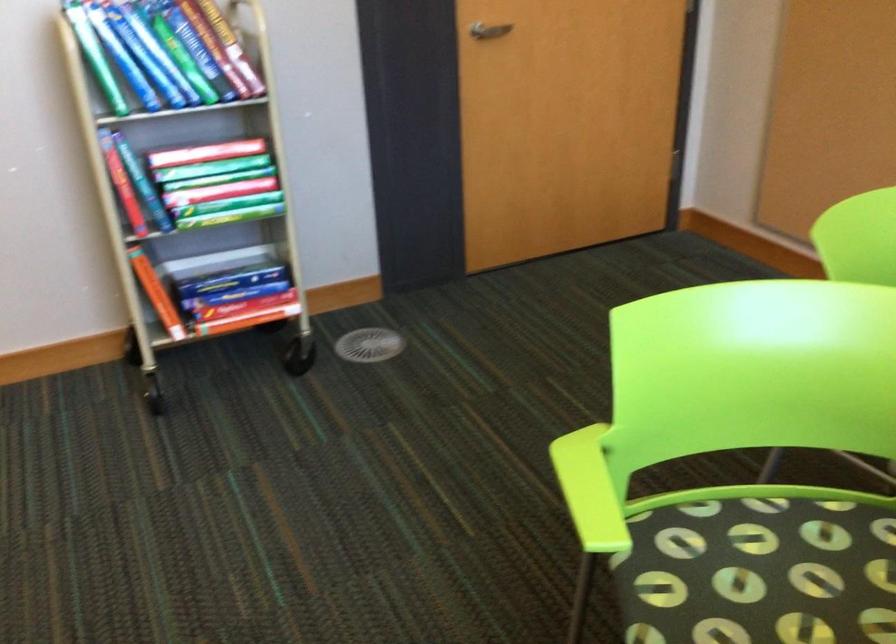
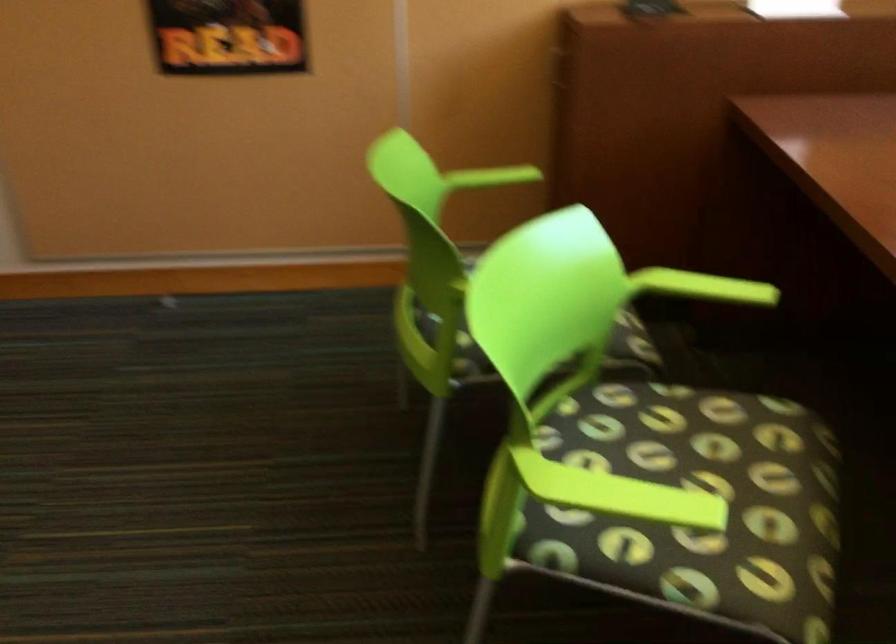
Question: The images are taken continuously from a first-person perspective. In which direction is your viewpoint rotating?

Choices:
 (A) Left
 (B) Right
 (C) Up
 (D) Down

Answer: (B)